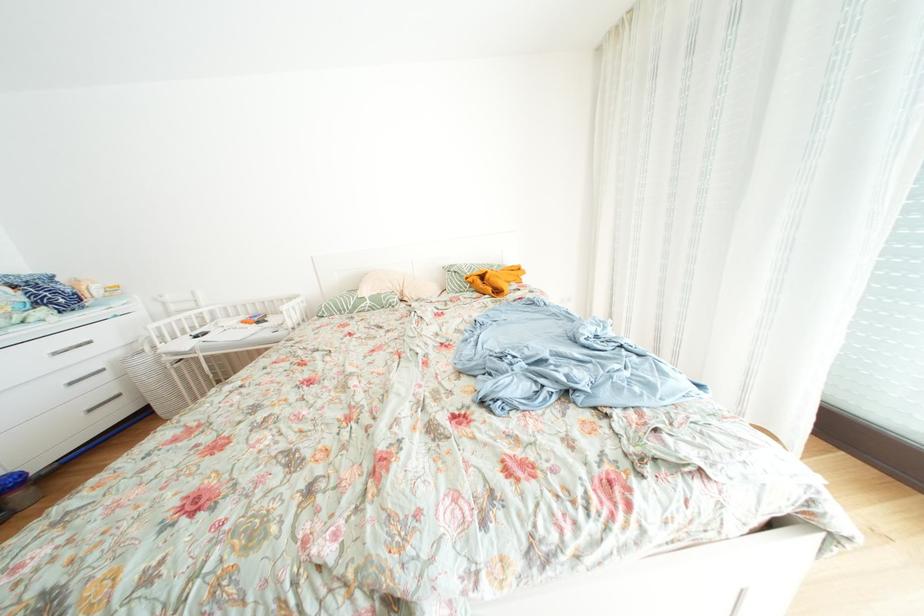
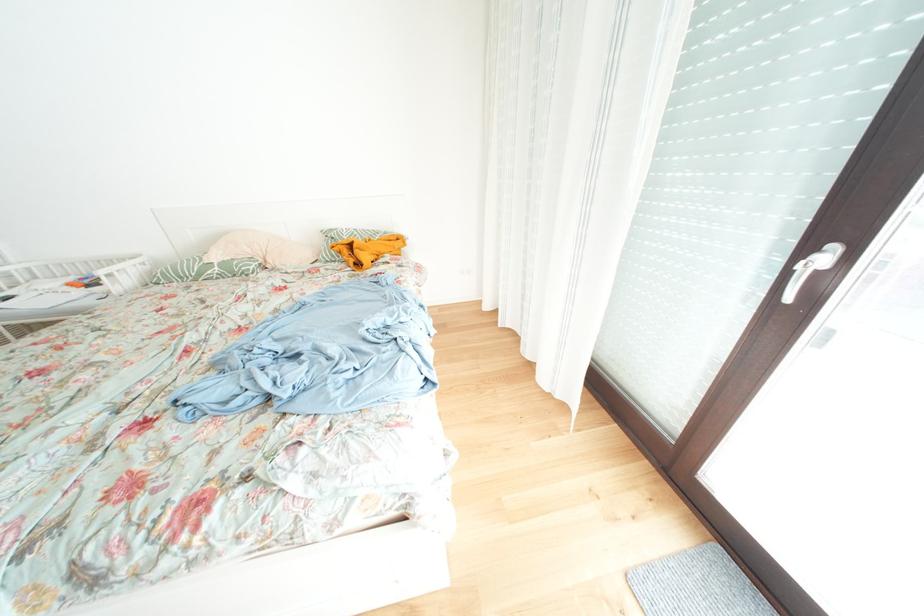
Question: In a continuous first-person perspective shot, in which direction is the camera moving?

Choices:
 (A) Left
 (B) Right
 (C) Forward
 (D) Backward

Answer: (B)